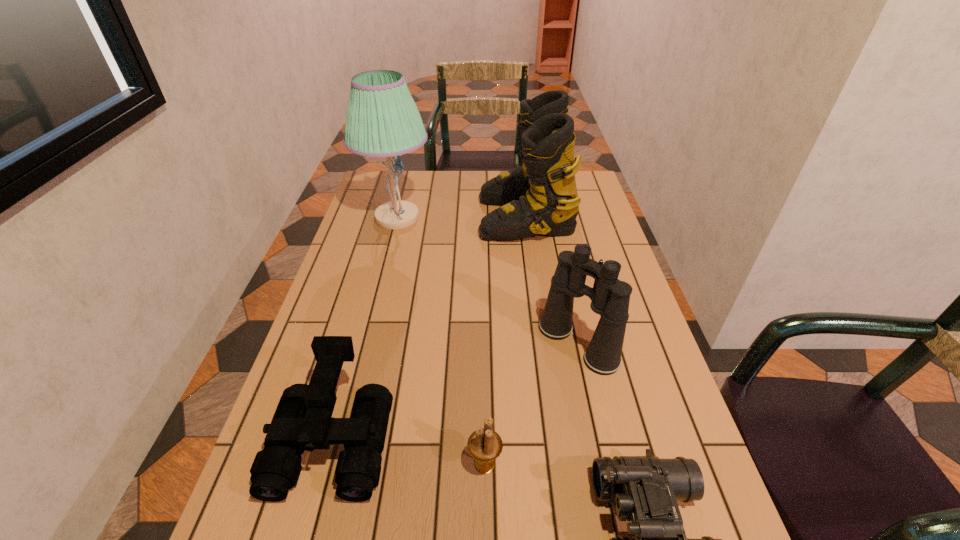
Locate which binoculars ranks third in proximity to the ski boots. Please provide its 2D coordinates. Your answer should be formatted as a tuple, i.e. [(x, y)], where the tuple contains the x and y coordinates of a point satisfying the conditions above.

[(646, 489)]

Find the location of `binoculars that is the closest to the candle holder`. binoculars that is the closest to the candle holder is located at coordinates (303, 421).

Image resolution: width=960 pixels, height=540 pixels. I want to click on free space that satisfies the following two spatial constraints: 1. on the back side of the fifth shortest object; 2. on the left side of the candle holder, so click(x=483, y=216).